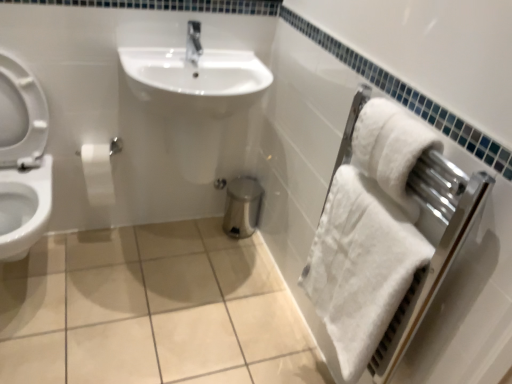
This screenshot has width=512, height=384. What do you see at coordinates (361, 266) in the screenshot? I see `white fluffy bath towel at right, positioned as the second bath towel in top-to-bottom order` at bounding box center [361, 266].

Image resolution: width=512 pixels, height=384 pixels. In order to click on white soft towel at right, which appears as the second bath towel when ordered from the bottom in this screenshot , I will do `click(390, 148)`.

Where is `white matte toilet paper at left`? white matte toilet paper at left is located at coordinates (98, 174).

What is the approximate height of white glossy sink at center?

It is 18.82 inches.

In order to face beige ceramic tile at center, should I rotate leftwards or rightwards?

Rotate your view left by about 13.040°.

Measure the distance between point (83, 262) and camera.

They are 1.86 meters apart.

I want to click on white fluffy bath towel at right, the first bath towel in the bottom-to-top sequence, so click(x=361, y=266).

Considering the positions of points (391, 19) and (152, 34), is point (391, 19) closer to camera compared to point (152, 34)?

That is True.

In the image, is white soft towel at right on the left side or the right side of white glossy sink at center?

white soft towel at right is to the right of white glossy sink at center.

Between white soft towel at right and white glossy sink at center, which one has smaller width?

Thinner between the two is white soft towel at right.

From a real-world perspective, which object rests below the other?

From a 3D spatial view, white glossy sink at center is below.

Would you say white soft towel at right is to the left or to the right of white fluffy bath towel at right, positioned as the second bath towel in top-to-bottom order, in the picture?

Clearly, white soft towel at right is on the right of white fluffy bath towel at right, positioned as the second bath towel in top-to-bottom order, in the image.

Who is shorter, white soft towel at right or white fluffy bath towel at right, the first bath towel in the bottom-to-top sequence?

With less height is white fluffy bath towel at right, the first bath towel in the bottom-to-top sequence.

Considering the points (502, 318) and (402, 255), which point is behind, point (502, 318) or point (402, 255)?

The point (402, 255) is farther from the camera.

Where is `the 2nd bath towel counting from the left of the white soft towel at right`? This screenshot has height=384, width=512. the 2nd bath towel counting from the left of the white soft towel at right is located at coordinates (361, 266).

Is beige ceramic tile at center not close to white soft towel at right?

They are positioned close to each other.

Considering the positions of objects beige ceramic tile at center and white soft towel at right in the image provided, who is in front, beige ceramic tile at center or white soft towel at right?

Positioned in front is white soft towel at right.

From the image's perspective, is beige ceramic tile at center below white soft towel at right?

Yes, from the image's perspective, beige ceramic tile at center is beneath white soft towel at right.

Is beige ceramic tile at center wider than white soft towel at right?

Yes, beige ceramic tile at center is wider than white soft towel at right.

From the image's perspective, is white soft towel at right, the 1th bath towel positioned from the top, on top of white glossy toilet at left?

Yes.

Does white soft towel at right, the 1th bath towel positioned from the top, contain white glossy toilet at left?

No, white glossy toilet at left is not inside white soft towel at right, the 1th bath towel positioned from the top.

Is white soft towel at right, the 1th bath towel positioned from the top, wider than white glossy toilet at left?

In fact, white soft towel at right, the 1th bath towel positioned from the top, might be narrower than white glossy toilet at left.

Does white soft towel at right touch beige ceramic tile at center?

No, white soft towel at right is not with beige ceramic tile at center.

Can you confirm if white soft towel at right is positioned to the left of beige ceramic tile at center?

In fact, white soft towel at right is to the right of beige ceramic tile at center.

In the scene shown: Is beige ceramic tile at center a part of white soft towel at right?

Actually, beige ceramic tile at center is outside white soft towel at right.

How different are the orientations of white soft towel at right and beige ceramic tile at center in degrees?

They differ by 90.2 degrees in their facing directions.

Can you tell me how much white soft towel at right and white glossy toilet at left differ in facing direction?

white soft towel at right and white glossy toilet at left are facing 90.4 degrees away from each other.

Visually, is white soft towel at right positioned to the left or to the right of white glossy toilet at left?

white soft towel at right is positioned on white glossy toilet at left's right side.

From a real-world perspective, is white soft towel at right over white glossy toilet at left?

Yes, from a real-world perspective, white soft towel at right is over white glossy toilet at left

Is the position of white soft towel at right, which appears as the second bath towel when ordered from the bottom, less distant than that of white glossy sink at center?

Yes, it is in front of white glossy sink at center.

Could white glossy sink at center be considered to be inside white soft towel at right, which appears as the second bath towel when ordered from the bottom?

Definitely not — white glossy sink at center is not inside white soft towel at right, which appears as the second bath towel when ordered from the bottom.

Is white soft towel at right, which appears as the second bath towel when ordered from the bottom, taller than white glossy sink at center?

Incorrect, the height of white soft towel at right, which appears as the second bath towel when ordered from the bottom, is not larger of that of white glossy sink at center.

From a real-world perspective, is white soft towel at right, which appears as the second bath towel when ordered from the bottom, physically above white glossy sink at center?

Yes.

You are a GUI agent. You are given a task and a screenshot of the screen. Output one action in this format:
    pyautogui.click(x=<x>, y=<y>)
    Task: Click on the sink below the white soft towel at right (from a real-world perspective)
    This screenshot has width=512, height=384.
    Given the screenshot: What is the action you would take?
    pyautogui.click(x=192, y=92)

Locate an element on the screen. This screenshot has width=512, height=384. bath that appears above the white fluffy bath towel at right, the first bath towel in the bottom-to-top sequence (from the image's perspective) is located at coordinates (374, 91).

Estimate the real-world distances between objects in this image. Which object is closer to white fluffy bath towel at right, positioned as the second bath towel in top-to-bottom order, satin nickel faucet at center or white soft towel at right, the 1th bath towel positioned from the top?

Among the two, white soft towel at right, the 1th bath towel positioned from the top, is located nearer to white fluffy bath towel at right, positioned as the second bath towel in top-to-bottom order.

Which object lies nearer to the anchor point white matte toilet paper at left, white soft towel at right or beige ceramic tile at center?

Based on the image, beige ceramic tile at center appears to be nearer to white matte toilet paper at left.

Looking at the image, which one is located further to white glossy sink at center, white soft towel at right, which appears as the second bath towel when ordered from the bottom, or white fluffy bath towel at right, positioned as the second bath towel in top-to-bottom order?

Among the two, white soft towel at right, which appears as the second bath towel when ordered from the bottom, is located further to white glossy sink at center.

Considering their positions, is white soft towel at right positioned closer to white matte toilet paper at left than white glossy toilet at left?

Among the two, white glossy toilet at left is located nearer to white matte toilet paper at left.

Based on their spatial positions, is white matte toilet paper at left or white glossy toilet at left further from white fluffy bath towel at right, positioned as the second bath towel in top-to-bottom order?

Among the two, white matte toilet paper at left is located further to white fluffy bath towel at right, positioned as the second bath towel in top-to-bottom order.

Based on their spatial positions, is white glossy toilet at left or white soft towel at right further from beige ceramic tile at center?

Based on the image, white soft towel at right appears to be further to beige ceramic tile at center.

Looking at the image, which one is located further to white matte toilet paper at left, white glossy toilet at left or white glossy sink at center?

white glossy sink at center lies further to white matte toilet paper at left than the other object.

Looking at the image, which one is located further to white glossy sink at center, white soft towel at right, which appears as the second bath towel when ordered from the bottom, or white matte toilet paper at left?

Based on the image, white soft towel at right, which appears as the second bath towel when ordered from the bottom, appears to be further to white glossy sink at center.

Identify the location of ceramic tile between white matte toilet paper at left and white soft towel at right. (151, 310).

Locate an element on the screen. The width and height of the screenshot is (512, 384). bath towel between satin nickel faucet at center and white fluffy bath towel at right, the first bath towel in the bottom-to-top sequence, in the vertical direction is located at coordinates click(390, 148).

Identify the location of sink between satin nickel faucet at center and beige ceramic tile at center from top to bottom. This screenshot has width=512, height=384. (192, 92).

Locate an element on the screen. The width and height of the screenshot is (512, 384). ceramic tile situated between white glossy toilet at left and white soft towel at right, the 1th bath towel positioned from the top, from left to right is located at coordinates (151, 310).